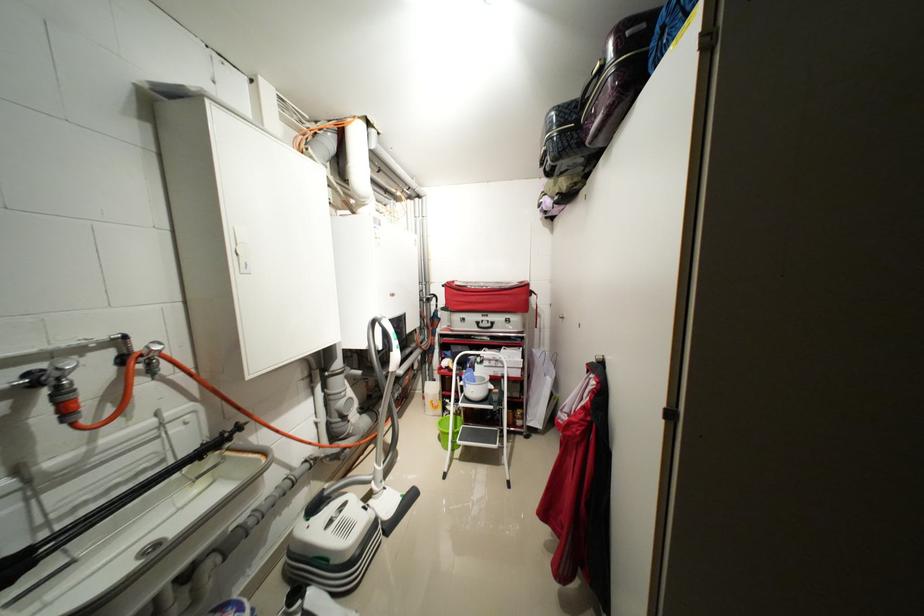
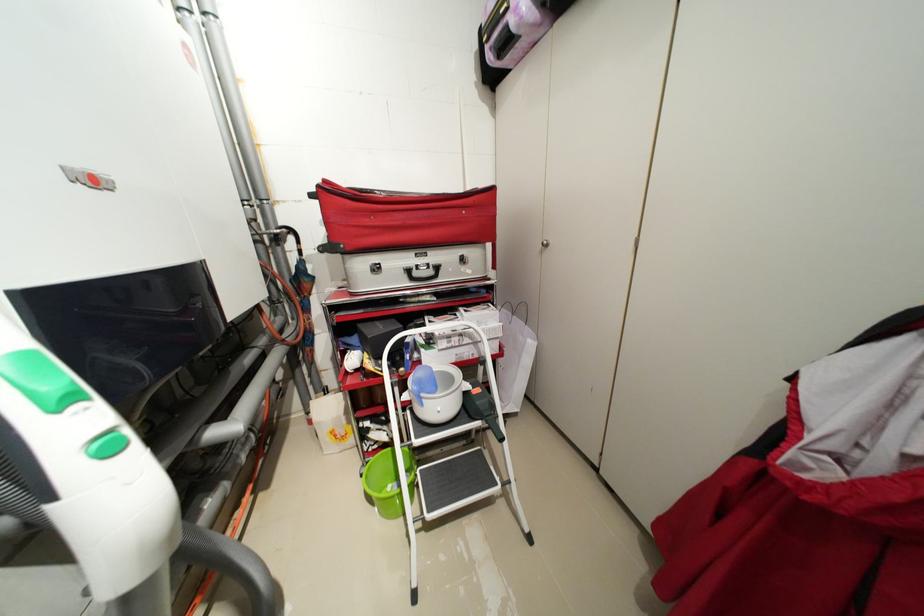
Find the pixel in the second image that matches the point at 527,378 in the first image.

(505, 352)